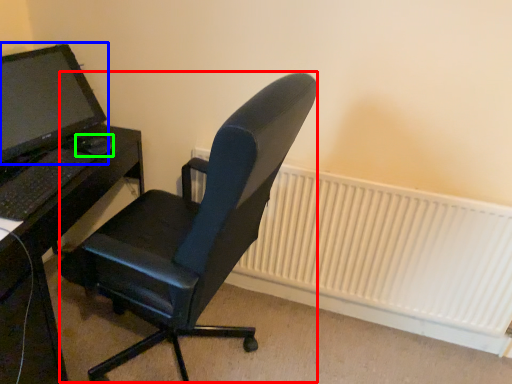
Question: Estimate the real-world distances between objects in this image. Which object is closer to computer chair (highlighted by a red box), computer monitor (highlighted by a blue box) or mouse (highlighted by a green box)?

Choices:
 (A) computer monitor
 (B) mouse

Answer: (B)